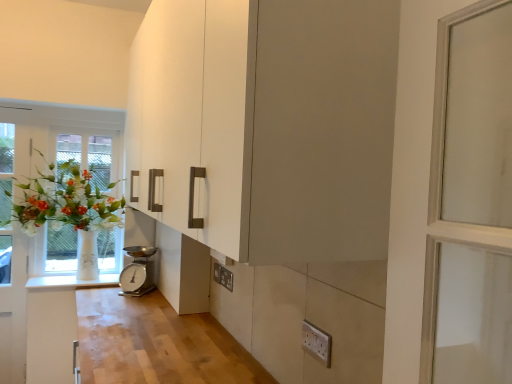
Question: Is white plastic electric outlet at lower right, which is the 2th electric outlet from back to front, at the left side of silver metallic scale at lower center?

Choices:
 (A) no
 (B) yes

Answer: (A)

Question: From the image's perspective, would you say white plastic electric outlet at lower right, marked as the first electric outlet in a right-to-left arrangement, is positioned over silver metallic scale at lower center?

Choices:
 (A) no
 (B) yes

Answer: (B)

Question: Considering the relative sizes of white plastic electric outlet at lower right, which is the second electric outlet in left-to-right order, and silver metallic scale at lower center in the image provided, is white plastic electric outlet at lower right, which is the second electric outlet in left-to-right order, wider than silver metallic scale at lower center?

Choices:
 (A) no
 (B) yes

Answer: (A)

Question: Is silver metallic scale at lower center at the back of white plastic electric outlet at lower right, which is the first electric outlet from front to back?

Choices:
 (A) no
 (B) yes

Answer: (A)

Question: Would you say white plastic electric outlet at lower right, marked as the first electric outlet in a right-to-left arrangement, contains silver metallic scale at lower center?

Choices:
 (A) no
 (B) yes

Answer: (A)

Question: Considering their positions, is white glass vase at left located in front of or behind white glossy counter top at lower left?

Choices:
 (A) front
 (B) behind

Answer: (A)

Question: From a real-world perspective, is white glass vase at left positioned above or below white glossy counter top at lower left?

Choices:
 (A) above
 (B) below

Answer: (A)

Question: From the image's perspective, is white glass vase at left above or below white glossy counter top at lower left?

Choices:
 (A) below
 (B) above

Answer: (B)

Question: From their relative heights in the image, would you say white glass vase at left is taller or shorter than white glossy counter top at lower left?

Choices:
 (A) tall
 (B) short

Answer: (A)

Question: Considering the positions of matte white cabinet at lower center and white glass vase at left in the image, is matte white cabinet at lower center taller or shorter than white glass vase at left?

Choices:
 (A) tall
 (B) short

Answer: (B)

Question: Looking at their shapes, would you say matte white cabinet at lower center is wider or thinner than white glass vase at left?

Choices:
 (A) wide
 (B) thin

Answer: (B)

Question: From a real-world perspective, relative to white glass vase at left, is matte white cabinet at lower center vertically above or below?

Choices:
 (A) above
 (B) below

Answer: (B)

Question: From the image's perspective, is matte white cabinet at lower center above or below white glass vase at left?

Choices:
 (A) above
 (B) below

Answer: (B)

Question: Is point (133, 251) closer or farther from the camera than point (196, 259)?

Choices:
 (A) farther
 (B) closer

Answer: (A)

Question: From a real-world perspective, relative to matte white cabinet at lower center, is silver metallic scale at lower center vertically above or below?

Choices:
 (A) below
 (B) above

Answer: (A)